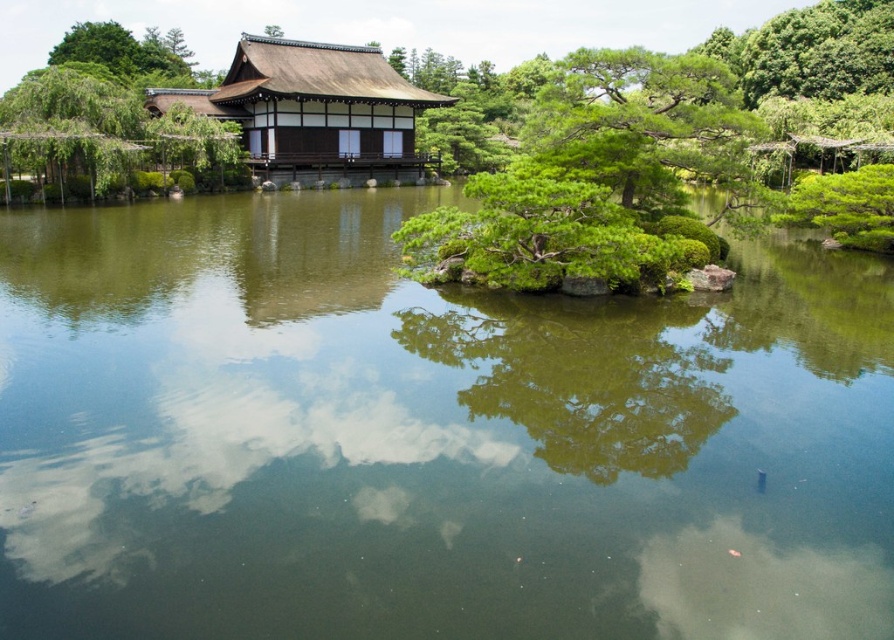
Measure the distance between point (179, 525) and camera.

30.60 feet

Between green reflective water at center and green textured pine tree at upper right, which one appears on the right side from the viewer's perspective?

Positioned to the right is green textured pine tree at upper right.

Does point (70, 589) come closer to viewer compared to point (715, 148)?

Yes, point (70, 589) is closer to viewer.

You are a GUI agent. You are given a task and a screenshot of the screen. Output one action in this format:
    pyautogui.click(x=<x>, y=<y>)
    Task: Click on the green reflective water at center
    This screenshot has width=894, height=640.
    Given the screenshot: What is the action you would take?
    pyautogui.click(x=428, y=436)